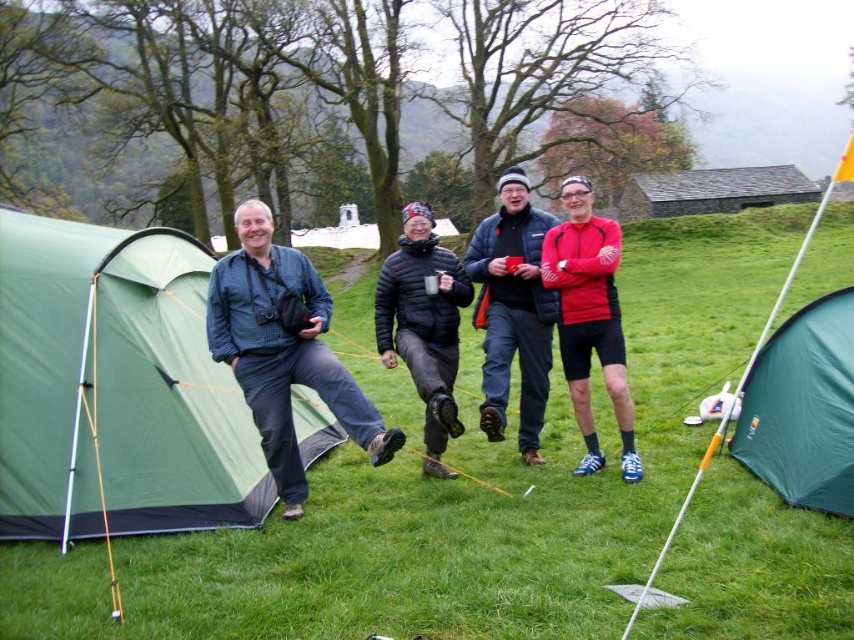
Which is more to the right, green grass at center or black puffy jacket at center?

green grass at center

Is green grass at center below black puffy jacket at center?

No, green grass at center is not below black puffy jacket at center.

Who is more forward, (846, 614) or (431, 392)?

Positioned in front is point (846, 614).

Where is `green grass at center`? This screenshot has width=854, height=640. green grass at center is located at coordinates (457, 493).

Can you confirm if green fabric tent at left is smaller than green fabric tent at lower right?

Actually, green fabric tent at left might be larger than green fabric tent at lower right.

Can you confirm if green fabric tent at left is thinner than green fabric tent at lower right?

In fact, green fabric tent at left might be wider than green fabric tent at lower right.

You are a GUI agent. You are given a task and a screenshot of the screen. Output one action in this format:
    pyautogui.click(x=<x>, y=<y>)
    Task: Click on the green fabric tent at left
    This screenshot has height=640, width=854.
    Given the screenshot: What is the action you would take?
    pyautogui.click(x=115, y=388)

Does green grass at center have a greater height compared to green fabric tent at left?

Indeed, green grass at center has a greater height compared to green fabric tent at left.

Who is more distant from viewer, (673,237) or (127,516)?

The point (673,237) is behind.

At what (x,y) coordinates should I click in order to perform the action: click on green grass at center. Please return your answer as a coordinate pair (x, y). Image resolution: width=854 pixels, height=640 pixels. Looking at the image, I should click on (457, 493).